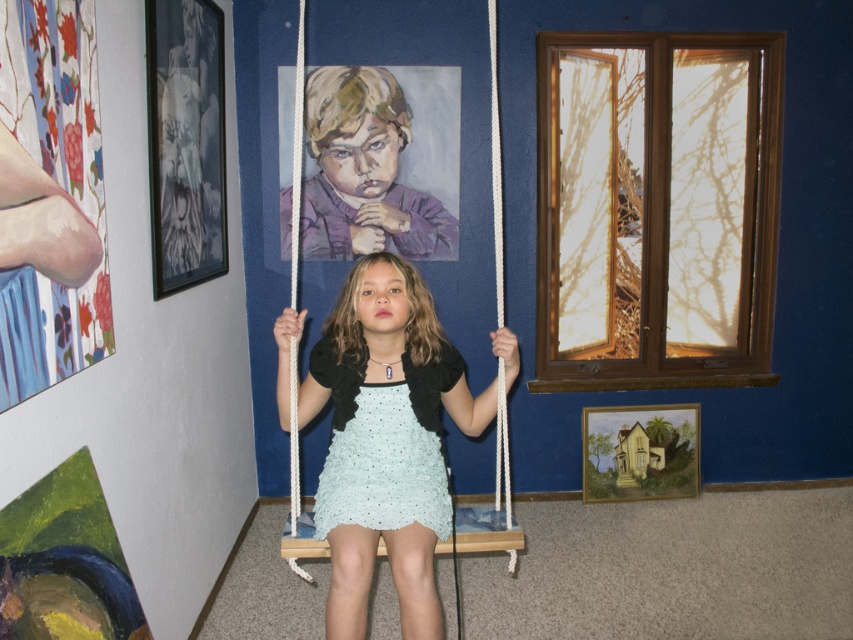
You are a fashion designer who wants to create a new dress design by combining the two dresses. Given that the distance between the light blue fabric dress at center and the light blue crocheted dress at center is 1.54 inches, can you determine if they can be combined without overlapping?

The distance between the light blue fabric dress at center and the light blue crocheted dress at center is 1.54 inches. Since the dresses are separated by this distance, they can be combined without overlapping as long as the combined design accounts for the space between them.

In the scene shown: You are a fashion designer observing the image. You need to determine which dress is more suitable for a photoshoot where height is a key factor. Which dress between the light blue fabric dress at center and the light blue crocheted dress at center should you choose?

The light blue fabric dress at center is much taller than the light blue crocheted dress at center, so it would be more suitable for a photoshoot emphasizing height.

You are an interior designer analyzing the room layout. The light blue fabric dress at center is placed at a specific coordinate. Considering the room has blue walls and a window casting shadows, where would you position a new floor lamp to ensure it doesn not block the view of the dress from the window?

The light blue fabric dress at center is located at point [387,419]. To avoid blocking its view from the window, position the floor lamp away from the direct line between the window and the dress, perhaps placing it near the wall opposite the window or in a corner where it won t interfere with the sightline.